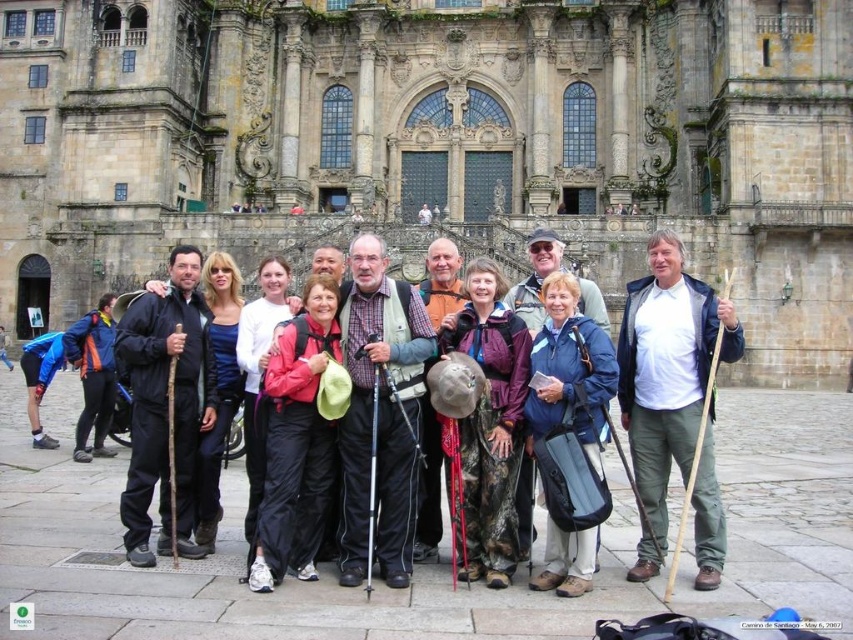
You are standing in front of the historic building and want to take a photo of the two points mentioned. Which point, point (567, 419) or point (283, 394), is closer to you?

Point (567, 419) is closer to the viewer than point (283, 394).

You are a photographer trying to capture a photo of the group in front of the cathedral. The black fabric backpack at center is located at coordinates 0.634 on the x and 0.195 on the y. If you want to ensure the backpack is centered in your shot, what adjustment should you make to your camera frame?

The black fabric backpack at center is already positioned at the center coordinates, so no adjustment is needed. The backpack is already centered in the frame.